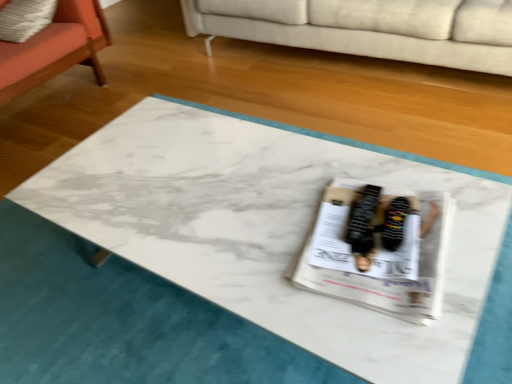
Identify the location of blank space to the left of white glossy magazine at center. This screenshot has height=384, width=512. (242, 240).